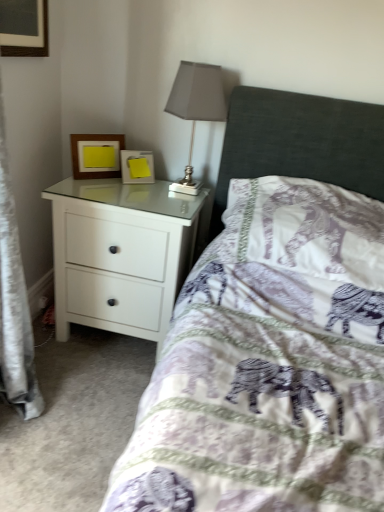
Identify the location of vacant area situated to the left side of matte gray lampshade at upper center. (134, 192).